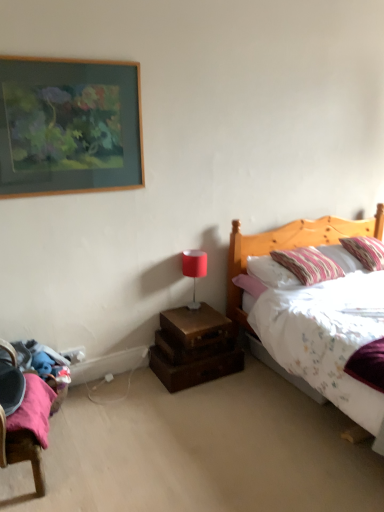
Question: Considering the relative positions of striped fabric pillow at upper right, the second pillow viewed from the left, and wooden trunk at lower center in the image provided, is striped fabric pillow at upper right, the second pillow viewed from the left, to the left or to the right of wooden trunk at lower center?

Choices:
 (A) left
 (B) right

Answer: (B)

Question: Is striped fabric pillow at upper right, which ranks as the 1th pillow in right-to-left order, taller or shorter than wooden trunk at lower center?

Choices:
 (A) short
 (B) tall

Answer: (B)

Question: Considering the real-world distances, which object is farthest from the striped fabric pillow at upper right, the 2th pillow when ordered from right to left?

Choices:
 (A) matte red lamp at center
 (B) wooden picture frame at upper left
 (C) striped fabric pillow at upper right, which ranks as the 1th pillow in right-to-left order
 (D) wooden trunk at lower center
 (E) wooden nightstand at lower center

Answer: (B)

Question: Estimate the real-world distances between objects in this image. Which object is farther from the striped fabric pillow at upper right, which ranks as the 1th pillow in right-to-left order?

Choices:
 (A) wooden picture frame at upper left
 (B) wooden nightstand at lower center
 (C) striped fabric pillow at upper right, which is the first pillow from left to right
 (D) matte red lamp at center
 (E) wooden trunk at lower center

Answer: (A)